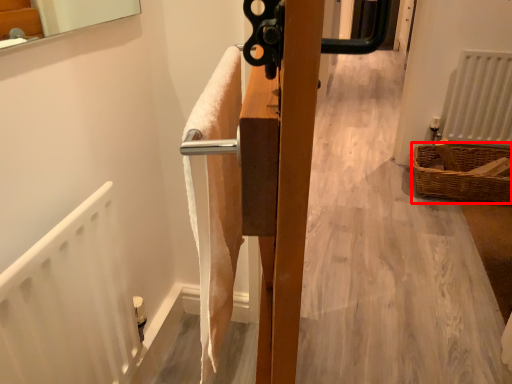
Question: Where is basket (annotated by the red box) located in relation to radiator in the image?

Choices:
 (A) left
 (B) right

Answer: (A)